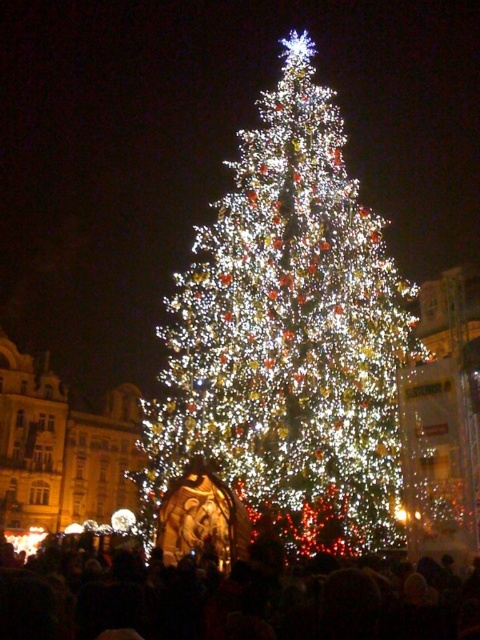
Who is positioned more to the left, illuminated white christmas tree at center or black matte crowd at lower center?

black matte crowd at lower center

Between illuminated white christmas tree at center and black matte crowd at lower center, which one is positioned higher?

illuminated white christmas tree at center is above.

Locate an element on the screen. illuminated white christmas tree at center is located at coordinates (288, 339).